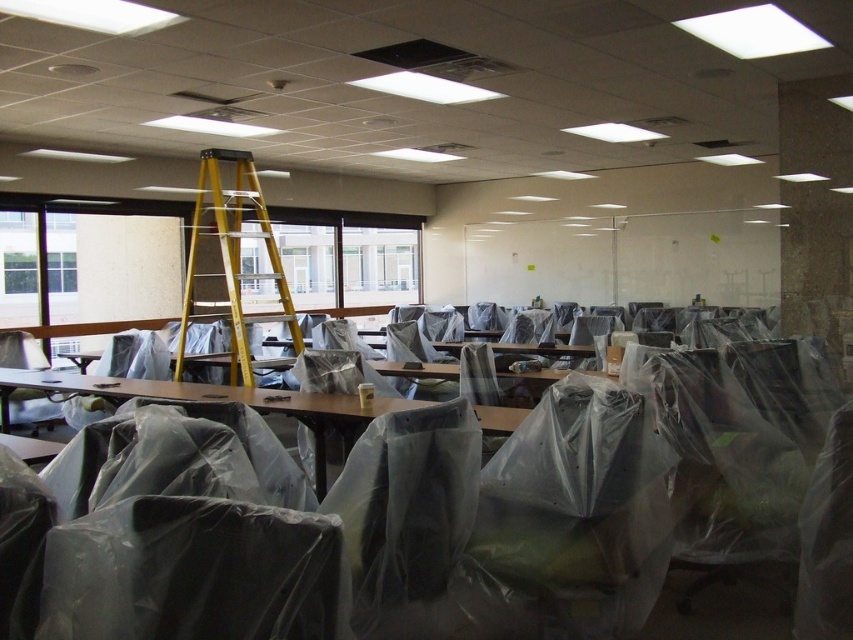
Question: Does yellow fiberglass ladder at upper center appear on the left side of clear plastic table at center?

Choices:
 (A) yes
 (B) no

Answer: (B)

Question: Can you confirm if clear plastic table at center is positioned to the right of clear plastic chair at lower left?

Choices:
 (A) yes
 (B) no

Answer: (A)

Question: Which of the following is the closest to the observer?

Choices:
 (A) clear plastic chair at lower left
 (B) yellow fiberglass ladder at upper center
 (C) clear plastic table at center

Answer: (C)

Question: Which of the following is the closest to the observer?

Choices:
 (A) (20, 390)
 (B) (434, 403)

Answer: (B)

Question: Based on their relative distances, which object is nearer to the yellow fiberglass ladder at upper center?

Choices:
 (A) clear plastic chair at lower left
 (B) clear plastic table at center

Answer: (B)

Question: Does yellow fiberglass ladder at upper center appear over clear plastic table at center?

Choices:
 (A) yes
 (B) no

Answer: (A)